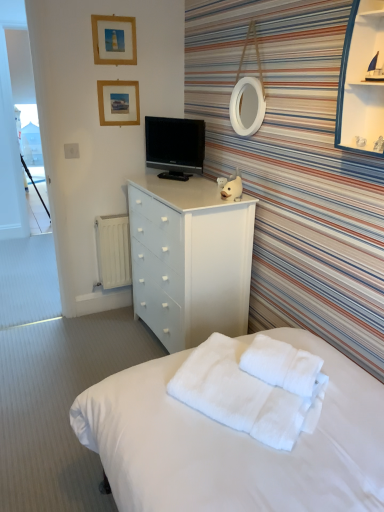
Question: From the image's perspective, is transparent glass cabinet at upper right located above or below white fluffy blanket at lower center?

Choices:
 (A) above
 (B) below

Answer: (A)

Question: Is transparent glass cabinet at upper right taller or shorter than white fluffy blanket at lower center?

Choices:
 (A) tall
 (B) short

Answer: (A)

Question: Considering the real-world distances, which object is closest to the white matte chest of drawers at center?

Choices:
 (A) white soft towel at lower center
 (B) black glossy tv at center
 (C) transparent glass cabinet at upper right
 (D) white matte radiator at left
 (E) white fluffy blanket at lower center

Answer: (B)

Question: Estimate the real-world distances between objects in this image. Which object is farther from the white soft towel at lower center?

Choices:
 (A) white fluffy blanket at lower center
 (B) transparent glass cabinet at upper right
 (C) wooden picture frame at upper center, the 1th picture frame ordered from the bottom
 (D) black glossy tv at center
 (E) white matte chest of drawers at center

Answer: (C)